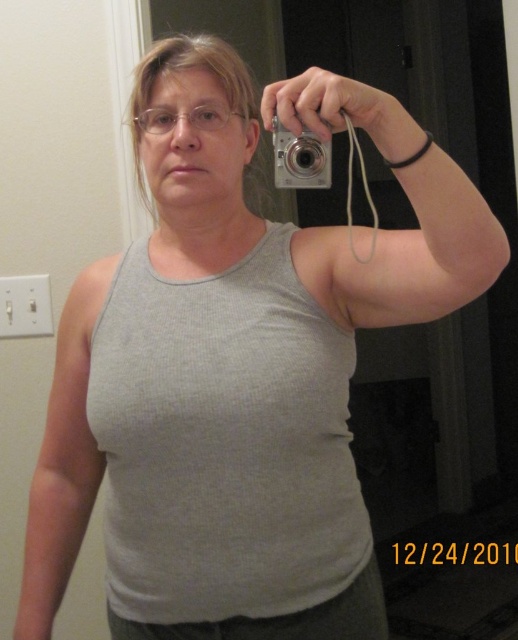
You are a photographer analyzing the image. You need to determine the position of the gray ribbed tank top at center relative to the clear plastic glasses at center. Which object is located to the right?

The gray ribbed tank top at center is positioned on the right side of clear plastic glasses at center, so the gray ribbed tank top at center is located to the right of the clear plastic glasses at center.

You are trying to take a selfie with the silver metallic camera at upper center while wearing the gray ribbed tank top at center. Based on their positions, can you confirm if the camera is positioned to the right of the tank top?

Yes, the gray ribbed tank top at center is to the left of the silver metallic camera at upper center, so the camera is positioned to the right of the tank top.

Based on the photo, you are a photographer trying to set up a tripod to capture the same shot as the person in the image. The tripod has a maximum reach of 6 inches. Can you position the tripod so that both the silver metallic camera at upper center and the clear plastic glasses at center are within the camera frame?

The silver metallic camera at upper center and clear plastic glasses at center are 6.76 inches apart from each other. Since the tripod has a maximum reach of 6 inches, it cannot cover the entire distance between them. Therefore, the tripod cannot position both objects within the camera frame simultaneously.